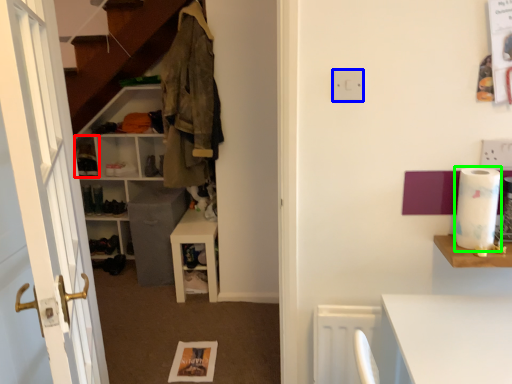
Question: Based on their relative distances, which object is nearer to cabinet (highlighted by a red box)? Choose from electric outlet (highlighted by a blue box) and toilet paper (highlighted by a green box).

Choices:
 (A) electric outlet
 (B) toilet paper

Answer: (A)